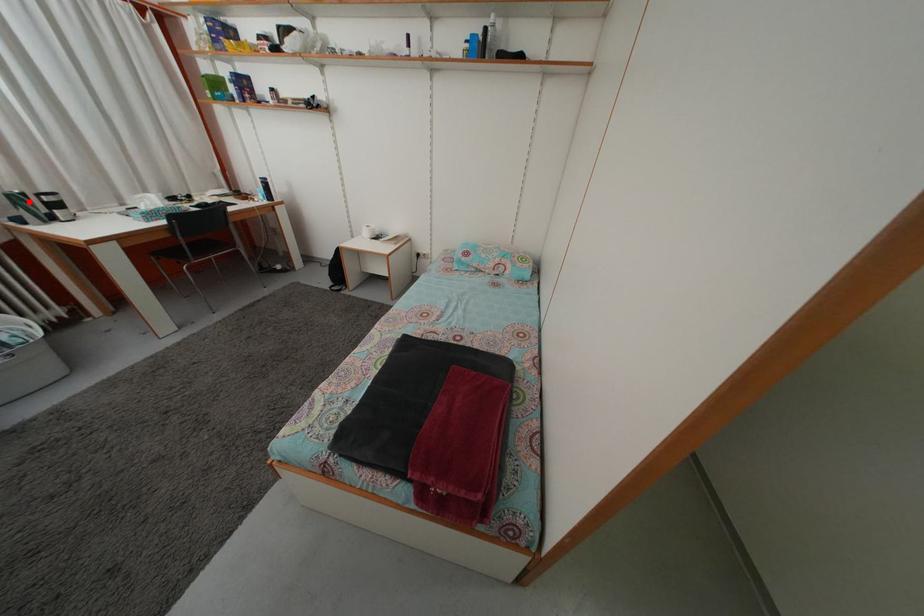
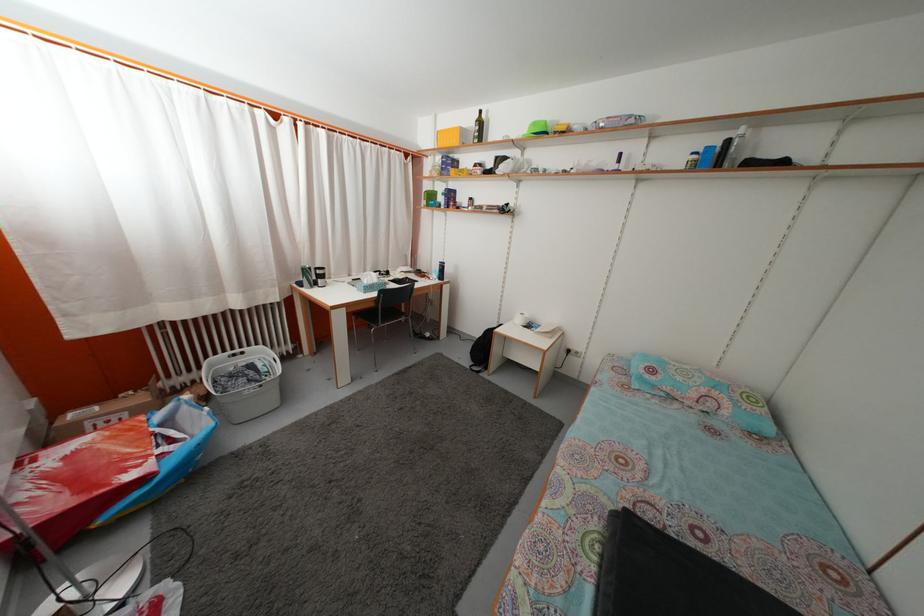
The point at the highlighted location is marked in the first image. Where is the corresponding point in the second image?

(315, 276)